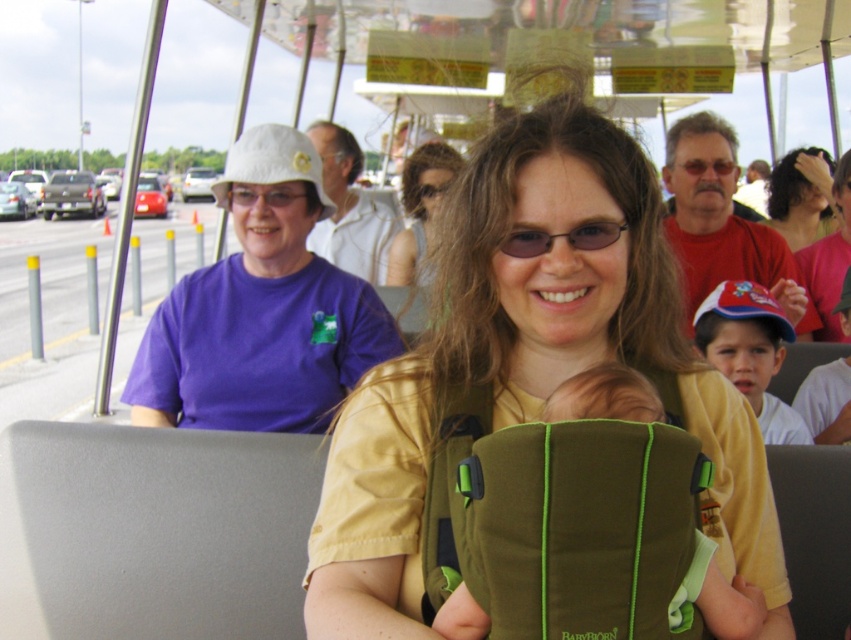
Question: Can you confirm if matte yellow shirt at center is positioned to the right of purple cotton shirt at upper left?

Choices:
 (A) no
 (B) yes

Answer: (B)

Question: Does matte yellow shirt at center lie in front of matte purple shirt at upper left?

Choices:
 (A) no
 (B) yes

Answer: (B)

Question: Is purple cotton shirt at upper left bigger than matte purple shirt at upper left?

Choices:
 (A) yes
 (B) no

Answer: (A)

Question: Which point is farther from the camera taking this photo?

Choices:
 (A) (176, 364)
 (B) (358, 212)

Answer: (B)

Question: Considering the real-world distances, which object is closest to the curly brown hair at upper right?

Choices:
 (A) white fabric coach at upper center
 (B) matte yellow shirt at center
 (C) red cotton shirt at upper right
 (D) purple cotton shirt at upper left

Answer: (C)

Question: Which point is farther from the camera taking this photo?

Choices:
 (A) (704, 244)
 (B) (831, 298)
 (C) (826, 225)
 (D) (333, 157)

Answer: (C)